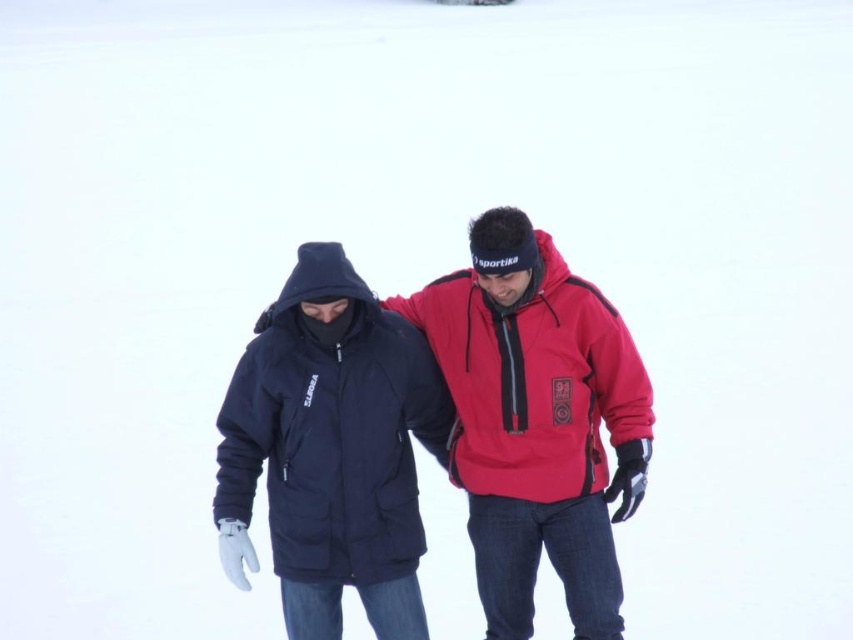
Question: Does navy blue softshell jacket at center lie behind matte red jacket at center?

Choices:
 (A) yes
 (B) no

Answer: (B)

Question: Which is farther from the navy blue softshell jacket at center?

Choices:
 (A) matte red jacket at center
 (B) matte black jacket at center

Answer: (B)

Question: Where is matte black jacket at center located in relation to navy blue softshell jacket at center in the image?

Choices:
 (A) above
 (B) below

Answer: (B)

Question: Can you confirm if matte black jacket at center is smaller than navy blue softshell jacket at center?

Choices:
 (A) no
 (B) yes

Answer: (A)

Question: Which object is the farthest from the matte black jacket at center?

Choices:
 (A) navy blue softshell jacket at center
 (B) matte red jacket at center

Answer: (A)

Question: Among these points, which one is farthest from the camera?

Choices:
 (A) (477, 285)
 (B) (422, 332)

Answer: (B)